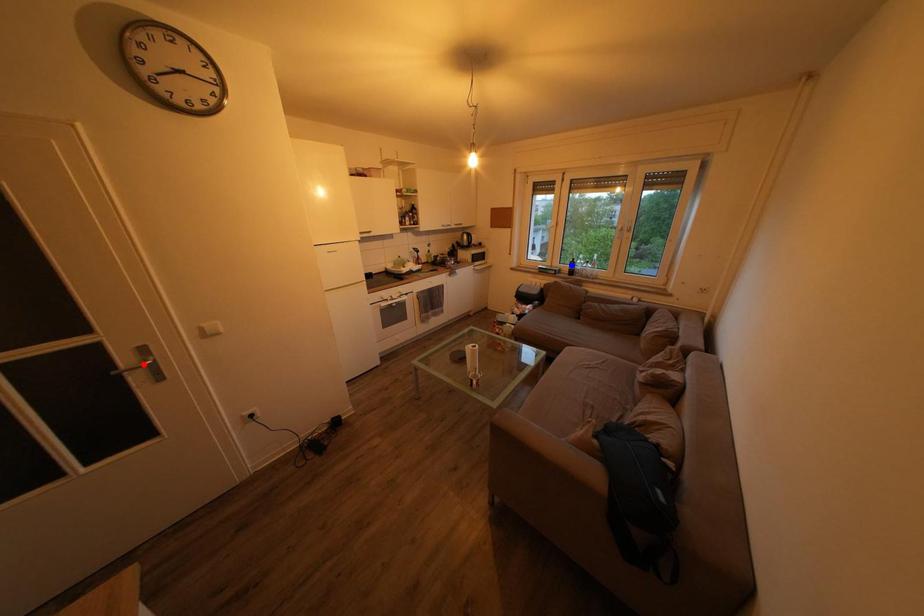
Question: Two points are marked on the image. Which point is closer to the camera?

Choices:
 (A) Blue point is closer.
 (B) Red point is closer.

Answer: (B)